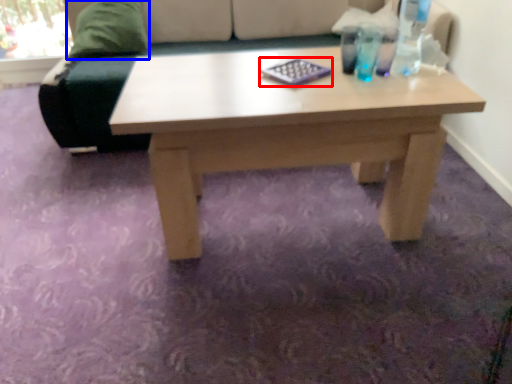
Question: Which of the following is the closest to the observer, pad (highlighted by a red box) or pillow (highlighted by a blue box)?

Choices:
 (A) pad
 (B) pillow

Answer: (A)